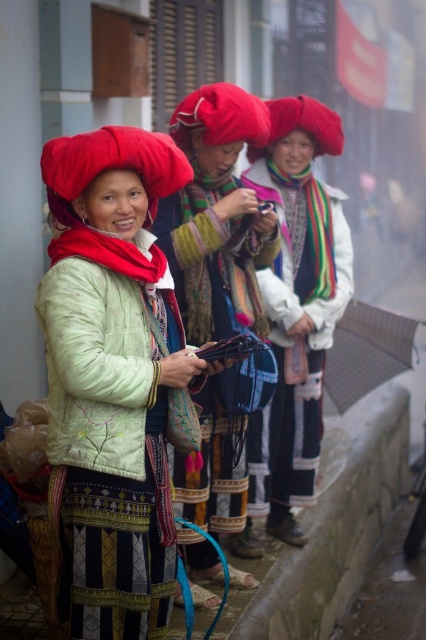
Question: Which of the following is the closest to the observer?

Choices:
 (A) velvet-like red headdress at left
 (B) matte red hat at center
 (C) concrete curb at lower right
 (D) textured fabric scarf at center

Answer: (A)

Question: Considering the relative positions of matte green jacket at center and matte red hat at center in the image provided, where is matte green jacket at center located with respect to matte red hat at center?

Choices:
 (A) below
 (B) above

Answer: (A)

Question: Does matte red hat at center have a smaller size compared to velvet-like red headdress at left?

Choices:
 (A) yes
 (B) no

Answer: (B)

Question: Does matte red hat at center have a lesser width compared to concrete curb at lower right?

Choices:
 (A) yes
 (B) no

Answer: (A)

Question: Which point is closer to the camera?

Choices:
 (A) concrete curb at lower right
 (B) textured fabric scarf at center
 (C) velvet-like red headdress at left
 (D) matte green jacket at center

Answer: (D)

Question: Considering the real-world distances, which object is farthest from the concrete curb at lower right?

Choices:
 (A) matte green jacket at center
 (B) velvet-like red headdress at left

Answer: (B)